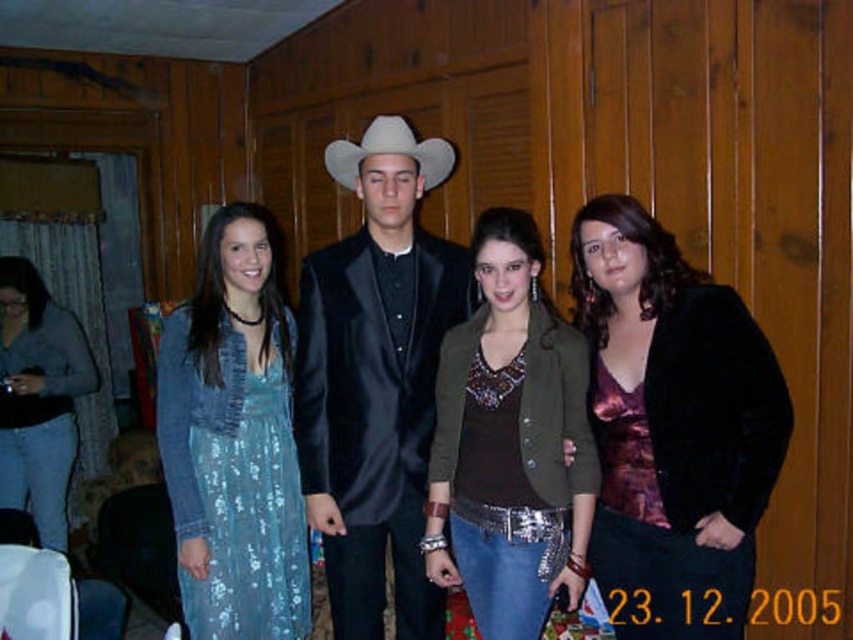
Is shiny purple blouse at center shorter than sequined blue dress at left?

Incorrect, shiny purple blouse at center's height does not fall short of sequined blue dress at left's.

What do you see at coordinates (672, 428) in the screenshot? This screenshot has height=640, width=853. I see `shiny purple blouse at center` at bounding box center [672, 428].

Does point (611, 256) lie in front of point (218, 497)?

Yes, it is in front of point (218, 497).

Where is `shiny purple blouse at center`? This screenshot has width=853, height=640. shiny purple blouse at center is located at coordinates (672, 428).

Between satin black suit at center and sequined blue dress at left, which one is positioned lower?

sequined blue dress at left

Find the location of `satin black suit at center`. satin black suit at center is located at coordinates (376, 378).

Who is shorter, satin black suit at center or white felt cowboy hat at center?

white felt cowboy hat at center is shorter.

Does satin black suit at center appear over white felt cowboy hat at center?

No.

Locate an element on the screen. The width and height of the screenshot is (853, 640). satin black suit at center is located at coordinates (376, 378).